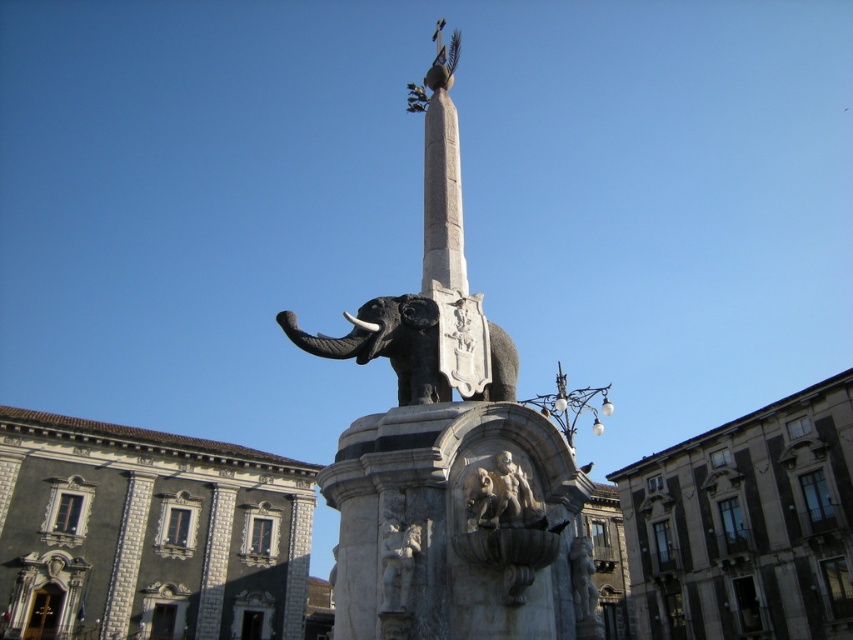
You are standing in front of the fountain monument and want to know if the point at coordinates point (842, 554) is closer to you than the point at point (404, 525). Can you determine this based on the structure?

Yes, the point at coordinates point (842, 554) is closer to you than the point at point (404, 525) because it is further to the viewer according to the description.

You are standing in a public square and see the gray stone fountain at center. If you want to take a photo of the fountain from a distance where it appears small but still recognizable, would 66.90 meters be a suitable distance?

The gray stone fountain at center is 66.90 meters away from the viewer. This distance would make the fountain appear small but still recognizable in the photo.

You are an art student analyzing the sculpture in the public square. You observe the polished stone elephant at center and the polished stone figures at center. Which object is placed higher up in the structure?

The polished stone elephant at center is positioned over the polished stone figures at center, so the elephant is higher up.